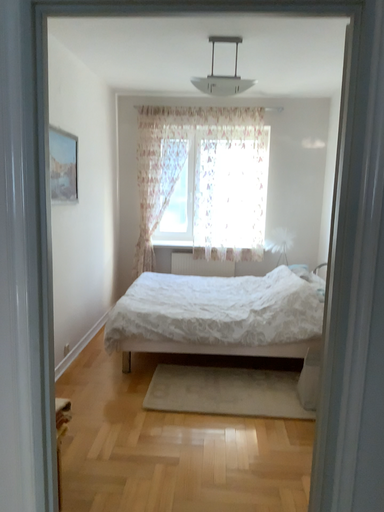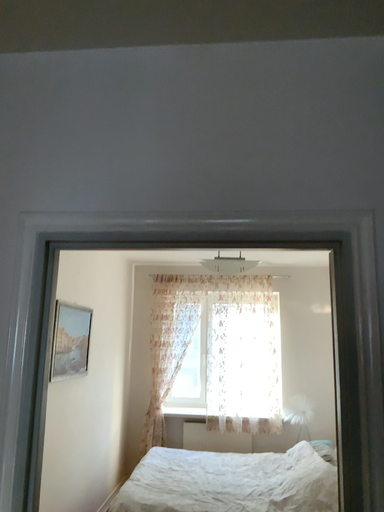
Question: Which way did the camera rotate in the video?

Choices:
 (A) rotated downward
 (B) rotated upward

Answer: (B)